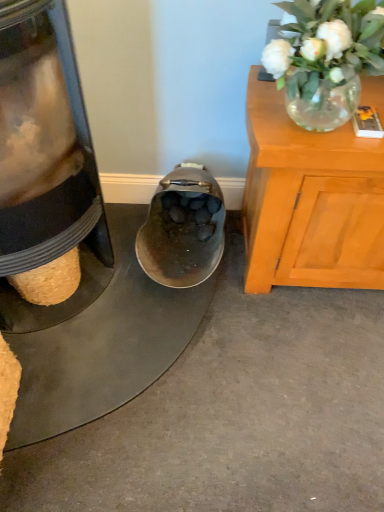
Question: From the image's perspective, does metallic bowl at center appear higher than translucent glass vase at upper right?

Choices:
 (A) yes
 (B) no

Answer: (B)

Question: Is metallic bowl at center further to camera compared to translucent glass vase at upper right?

Choices:
 (A) yes
 (B) no

Answer: (A)

Question: Does metallic bowl at center have a lesser height compared to translucent glass vase at upper right?

Choices:
 (A) no
 (B) yes

Answer: (B)

Question: From the image's perspective, is metallic bowl at center below translucent glass vase at upper right?

Choices:
 (A) no
 (B) yes

Answer: (B)

Question: Can you confirm if metallic bowl at center is bigger than translucent glass vase at upper right?

Choices:
 (A) no
 (B) yes

Answer: (A)

Question: Does metallic bowl at center have a greater width compared to translucent glass vase at upper right?

Choices:
 (A) no
 (B) yes

Answer: (B)

Question: Is shiny metallic shoe at center not inside metallic bowl at center?

Choices:
 (A) no
 (B) yes

Answer: (B)

Question: Is shiny metallic shoe at center at the left side of metallic bowl at center?

Choices:
 (A) yes
 (B) no

Answer: (B)

Question: Is metallic bowl at center completely or partially inside shiny metallic shoe at center?

Choices:
 (A) yes
 (B) no

Answer: (B)

Question: From the image's perspective, does shiny metallic shoe at center appear higher than metallic bowl at center?

Choices:
 (A) yes
 (B) no

Answer: (A)

Question: From the image's perspective, is shiny metallic shoe at center beneath metallic bowl at center?

Choices:
 (A) yes
 (B) no

Answer: (B)

Question: Does shiny metallic shoe at center turn towards metallic bowl at center?

Choices:
 (A) yes
 (B) no

Answer: (B)

Question: Does translucent glass vase at upper right have a greater width compared to shiny metallic shoe at center?

Choices:
 (A) yes
 (B) no

Answer: (B)